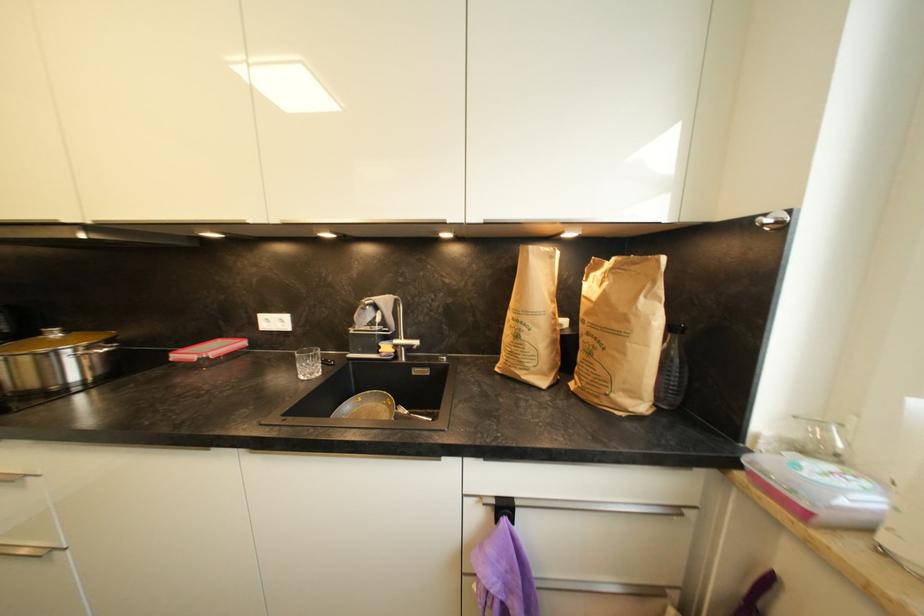
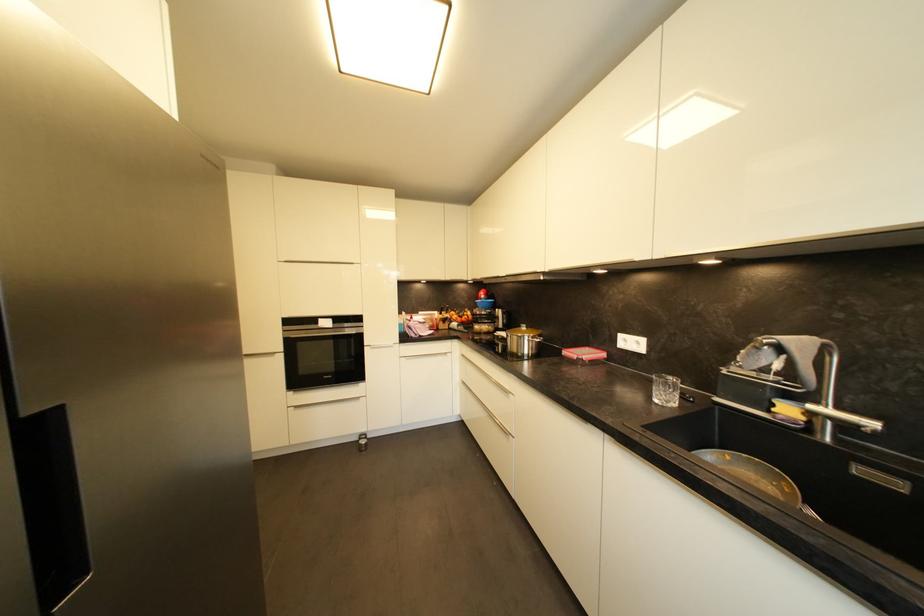
Find the pixel in the second image that matches (x=239, y=339) in the first image.

(602, 350)